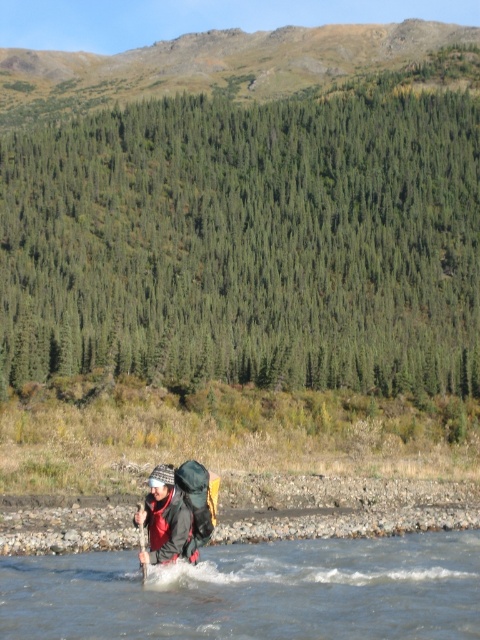
Question: Is clear water at center below wooden paddle at center?

Choices:
 (A) yes
 (B) no

Answer: (B)

Question: Among these objects, which one is farthest from the camera?

Choices:
 (A) clear water at center
 (B) matte black backpack at center

Answer: (B)

Question: Based on their relative distances, which object is farther from the matte black backpack at center?

Choices:
 (A) wooden paddle at center
 (B) clear water at center

Answer: (B)

Question: Is the position of clear water at center more distant than that of matte black backpack at center?

Choices:
 (A) yes
 (B) no

Answer: (B)

Question: Is clear water at center positioned before wooden paddle at center?

Choices:
 (A) yes
 (B) no

Answer: (A)

Question: Among these points, which one is nearest to the camera?

Choices:
 (A) (123, 577)
 (B) (139, 502)

Answer: (A)